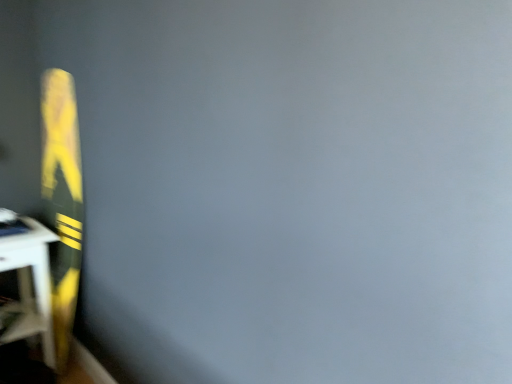
Question: Looking at the image, does green matte board at left seem bigger or smaller compared to matte black table at left?

Choices:
 (A) small
 (B) big

Answer: (B)

Question: Is green matte board at left inside or outside of matte black table at left?

Choices:
 (A) outside
 (B) inside

Answer: (A)

Question: Considering the positions of point (70, 200) and point (49, 281), is point (70, 200) closer or farther from the camera than point (49, 281)?

Choices:
 (A) farther
 (B) closer

Answer: (B)

Question: Considering the positions of matte black table at left and green matte board at left in the image, is matte black table at left wider or thinner than green matte board at left?

Choices:
 (A) thin
 (B) wide

Answer: (B)

Question: Is point (19, 309) positioned closer to the camera than point (42, 104)?

Choices:
 (A) closer
 (B) farther

Answer: (A)

Question: Is matte black table at left taller or shorter than green matte board at left?

Choices:
 (A) short
 (B) tall

Answer: (A)

Question: From a real-world perspective, is matte black table at left positioned above or below green matte board at left?

Choices:
 (A) below
 (B) above

Answer: (A)